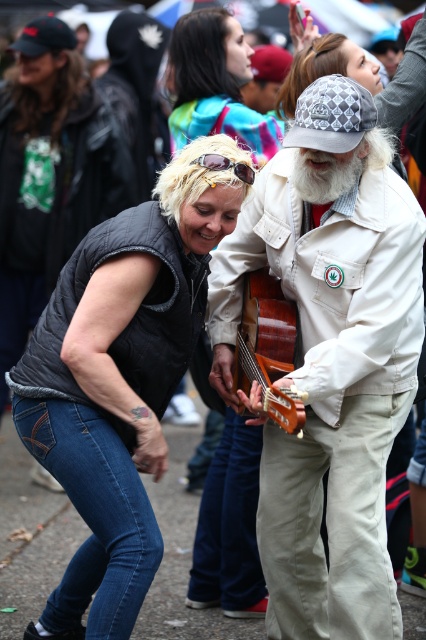
Where is `white cotton jacket at center`? white cotton jacket at center is located at coordinates (330, 365).

Based on the photo, which is above, white cotton jacket at center or whitewoollybeard at center?

Positioned higher is whitewoollybeard at center.

Is point (386, 419) closer to camera compared to point (324, 182)?

No, it is not.

Identify the location of white cotton jacket at center. This screenshot has height=640, width=426. (330, 365).

Between point (268, 148) and point (253, 173), which one is positioned in front?

Point (253, 173) is more forward.

Looking at this image, does multicolored fabric at upper center come behind gold reflective sunglasses at upper center?

Yes, it is behind gold reflective sunglasses at upper center.

Does point (270, 154) come closer to viewer compared to point (247, 163)?

No, it is not.

Where is `multicolored fabric at upper center`? Image resolution: width=426 pixels, height=640 pixels. multicolored fabric at upper center is located at coordinates (215, 84).

Find the location of a particular element. white cotton jacket at center is located at coordinates (330, 365).

Is white cotton jacket at center taller than denim vest at lower left?

Indeed, white cotton jacket at center has a greater height compared to denim vest at lower left.

Is point (340, 280) positioned behind point (206, 225)?

Yes, point (340, 280) is behind point (206, 225).

Identify the location of white cotton jacket at center. This screenshot has width=426, height=640. (330, 365).